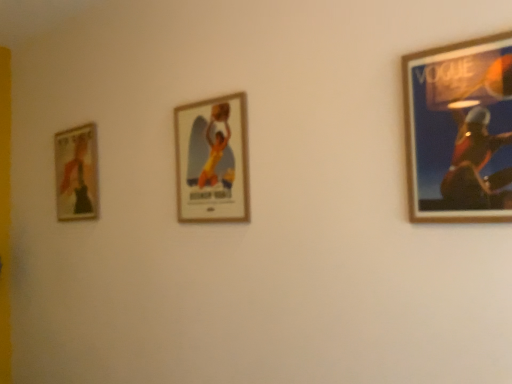
Question: From the image's perspective, is wooden frame at right, which is the 3th picture frame from back to front, above or below wooden framed poster at center, acting as the second picture frame starting from the front?

Choices:
 (A) above
 (B) below

Answer: (A)

Question: Is wooden frame at right, which is the 1th picture frame in right-to-left order, inside the boundaries of wooden framed poster at center, the 2th picture frame in the left-to-right sequence, or outside?

Choices:
 (A) inside
 (B) outside

Answer: (B)

Question: Which object is the closest to the matte gold picture frame at left, the third picture frame from the front?

Choices:
 (A) wooden framed poster at center, the second picture frame positioned from the back
 (B) wooden frame at right, the 1th picture frame when ordered from front to back

Answer: (A)

Question: Based on their relative distances, which object is nearer to the matte gold picture frame at left, the third picture frame from the front?

Choices:
 (A) wooden framed poster at center, the 2th picture frame in the left-to-right sequence
 (B) wooden frame at right, acting as the 3th picture frame starting from the left

Answer: (A)